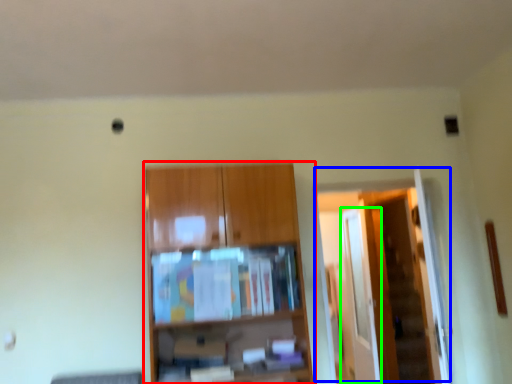
Question: Which object is the farthest from cupboard (highlighted by a red box)? Choose among these: door (highlighted by a blue box) or glass door (highlighted by a green box).

Choices:
 (A) door
 (B) glass door

Answer: (B)